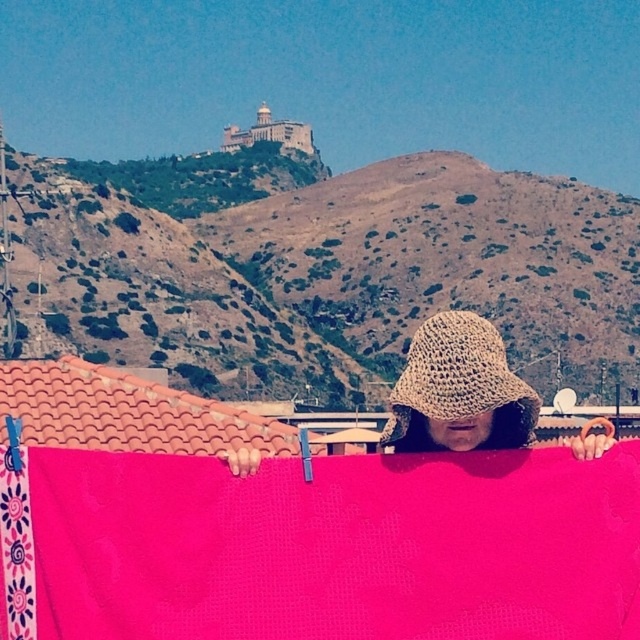
Question: Does pink woven cloth at center lie in front of crochet hat at center?

Choices:
 (A) no
 (B) yes

Answer: (B)

Question: Which point is farther to the camera?

Choices:
 (A) crochet hat at center
 (B) pink woven cloth at center

Answer: (A)

Question: Can you confirm if pink woven cloth at center is positioned to the right of crochet hat at center?

Choices:
 (A) no
 (B) yes

Answer: (A)

Question: Does pink woven cloth at center appear on the left side of crochet hat at center?

Choices:
 (A) no
 (B) yes

Answer: (B)